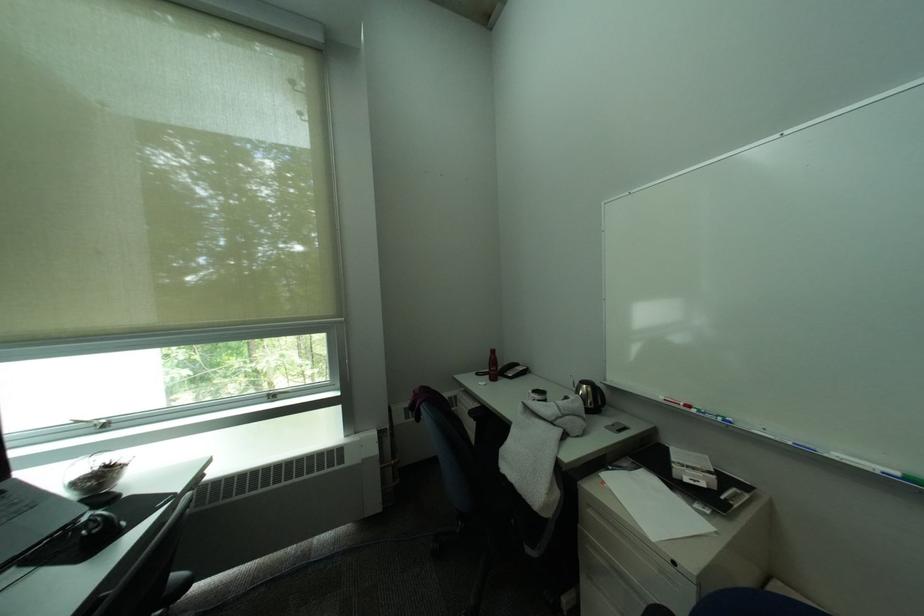
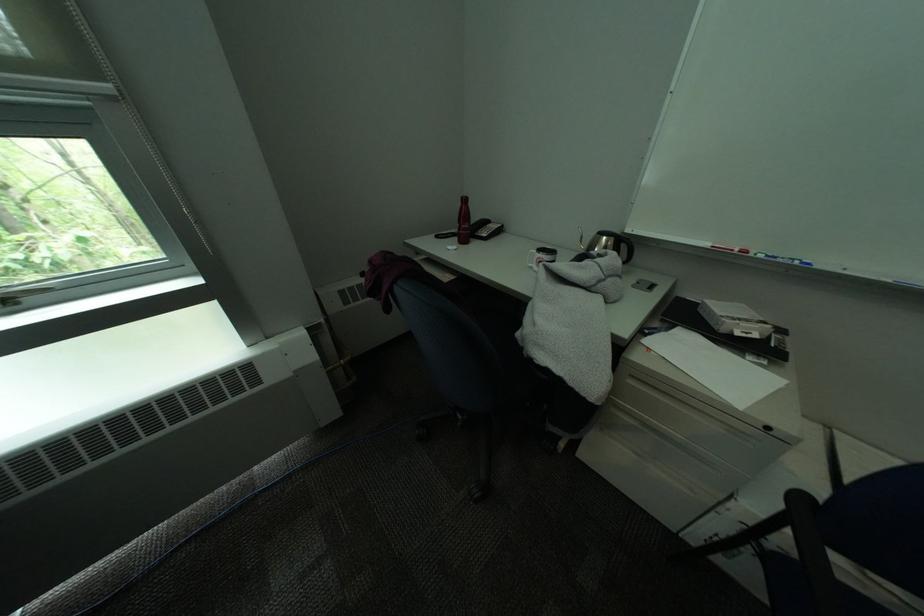
Locate, in the second image, the point that corresponds to pixel 719 416 in the first image.

(791, 262)